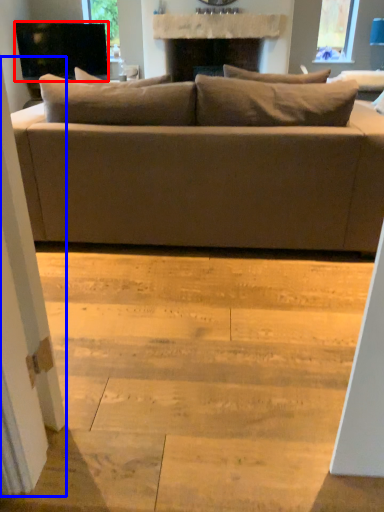
Question: Which of the following is the closest to the observer, television (highlighted by a red box) or screen door (highlighted by a blue box)?

Choices:
 (A) television
 (B) screen door

Answer: (B)